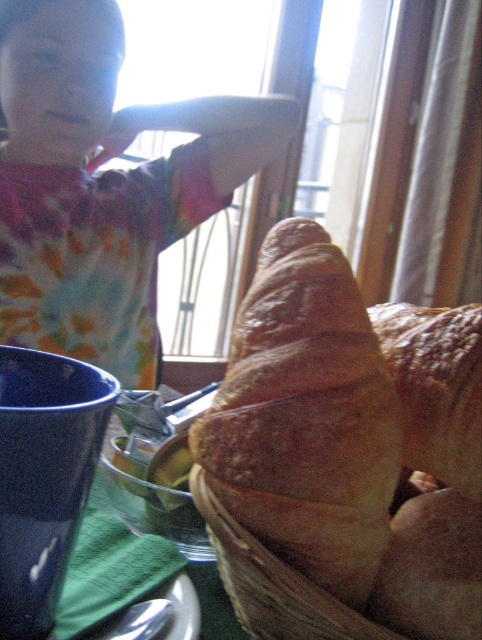
You are standing in the breakfast area and want to reach two points in the scene. The first point is at coordinate point [186,188] and the second is at point [299,358]. Which point is closer to you?

Point [186,188] is closer to you because it is further to the camera than point [299,358].

You are standing at the point labeled point (224, 172) and want to reach the door located 36.33 inches away. Can you safely walk in a straight line to the door without any obstacles?

Yes, since the distance between point (224, 172) and the door is exactly 36.33 inches, there are no obstacles in the way according to the scene description.